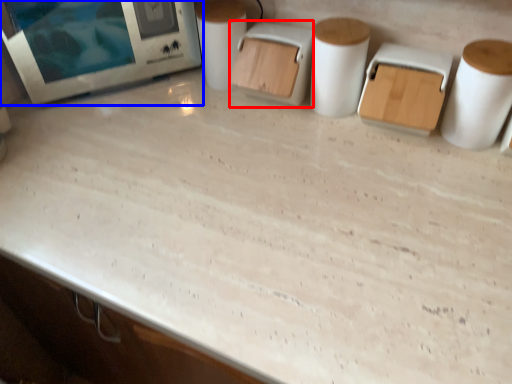
Question: Among these objects, which one is nearest to the camera, appliance (highlighted by a red box) or home appliance (highlighted by a blue box)?

Choices:
 (A) appliance
 (B) home appliance

Answer: (A)